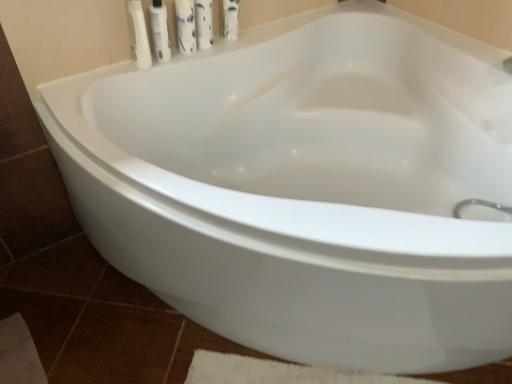
Question: Can you confirm if white glossy mouthwash at upper center is taller than white glossy bottle at upper left, the 2th toiletry viewed from the left?

Choices:
 (A) yes
 (B) no

Answer: (B)

Question: Is white glossy mouthwash at upper center bigger than white glossy bottle at upper left, the 2th toiletry viewed from the left?

Choices:
 (A) no
 (B) yes

Answer: (B)

Question: From the image's perspective, is white glossy mouthwash at upper center over white glossy bottle at upper left, the 1th toiletry viewed from the right?

Choices:
 (A) yes
 (B) no

Answer: (A)

Question: Considering the relative sizes of white glossy mouthwash at upper center and white glossy bottle at upper left, the 2th toiletry viewed from the left, in the image provided, is white glossy mouthwash at upper center smaller than white glossy bottle at upper left, the 2th toiletry viewed from the left,?

Choices:
 (A) no
 (B) yes

Answer: (A)

Question: Can we say white glossy mouthwash at upper center lies outside white glossy bottle at upper left, the 1th toiletry viewed from the right?

Choices:
 (A) no
 (B) yes

Answer: (B)

Question: From their relative heights in the image, would you say white glossy bottle at upper left, the first cleaning product when ordered from left to right, is taller or shorter than white glossy bottle at upper center, which is counted as the 1th cleaning product, starting from the right?

Choices:
 (A) tall
 (B) short

Answer: (B)

Question: Based on their positions, is white glossy bottle at upper left, which is the 2th cleaning product from right to left, located to the left or right of white glossy bottle at upper center, the 2th cleaning product when ordered from left to right?

Choices:
 (A) right
 (B) left

Answer: (B)

Question: Do you think white glossy bottle at upper left, the first cleaning product when ordered from left to right, is within white glossy bottle at upper center, the 2th cleaning product when ordered from left to right, or outside of it?

Choices:
 (A) outside
 (B) inside

Answer: (A)

Question: Based on their sizes in the image, would you say white glossy bottle at upper left, which is the 2th cleaning product from right to left, is bigger or smaller than white glossy bottle at upper center, the 2th cleaning product when ordered from left to right?

Choices:
 (A) small
 (B) big

Answer: (B)

Question: From a real-world perspective, is white glossy bottle at upper left, the first cleaning product when ordered from left to right, positioned above or below white glossy mouthwash at upper center?

Choices:
 (A) below
 (B) above

Answer: (B)

Question: Is white glossy bottle at upper left, which is the 2th cleaning product from right to left, spatially inside white glossy mouthwash at upper center, or outside of it?

Choices:
 (A) inside
 (B) outside

Answer: (B)

Question: Considering the positions of white glossy bottle at upper left, the first cleaning product when ordered from left to right, and white glossy mouthwash at upper center in the image, is white glossy bottle at upper left, the first cleaning product when ordered from left to right, wider or thinner than white glossy mouthwash at upper center?

Choices:
 (A) thin
 (B) wide

Answer: (A)

Question: Considering the positions of white glossy bottle at upper left, which is the 2th cleaning product from right to left, and white glossy mouthwash at upper center in the image, is white glossy bottle at upper left, which is the 2th cleaning product from right to left, bigger or smaller than white glossy mouthwash at upper center?

Choices:
 (A) small
 (B) big

Answer: (B)

Question: Would you say white glossy bottle at upper left, which is the 2th cleaning product from right to left, is to the left or to the right of white plastic tube at upper left, arranged as the 1th toiletry when viewed from the left, in the picture?

Choices:
 (A) left
 (B) right

Answer: (B)

Question: In terms of size, does white glossy bottle at upper left, the first cleaning product when ordered from left to right, appear bigger or smaller than white plastic tube at upper left, arranged as the 1th toiletry when viewed from the left?

Choices:
 (A) big
 (B) small

Answer: (B)